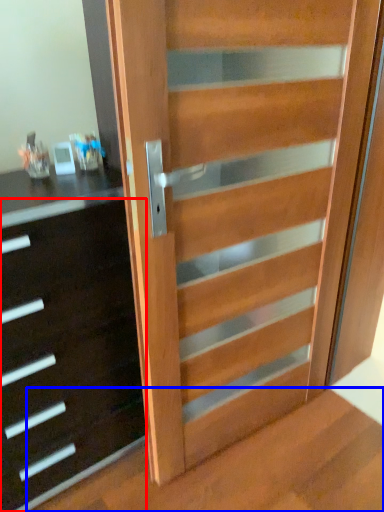
Question: Which object is further to the camera taking this photo, chest of drawers (highlighted by a red box) or stairwell (highlighted by a blue box)?

Choices:
 (A) chest of drawers
 (B) stairwell

Answer: (A)